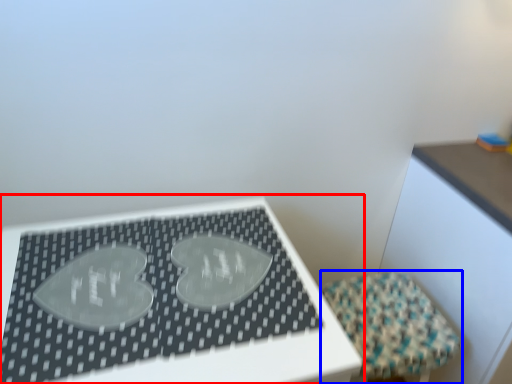
Question: Among these objects, which one is nearest to the camera, table (highlighted by a red box) or furniture (highlighted by a blue box)?

Choices:
 (A) table
 (B) furniture

Answer: (A)